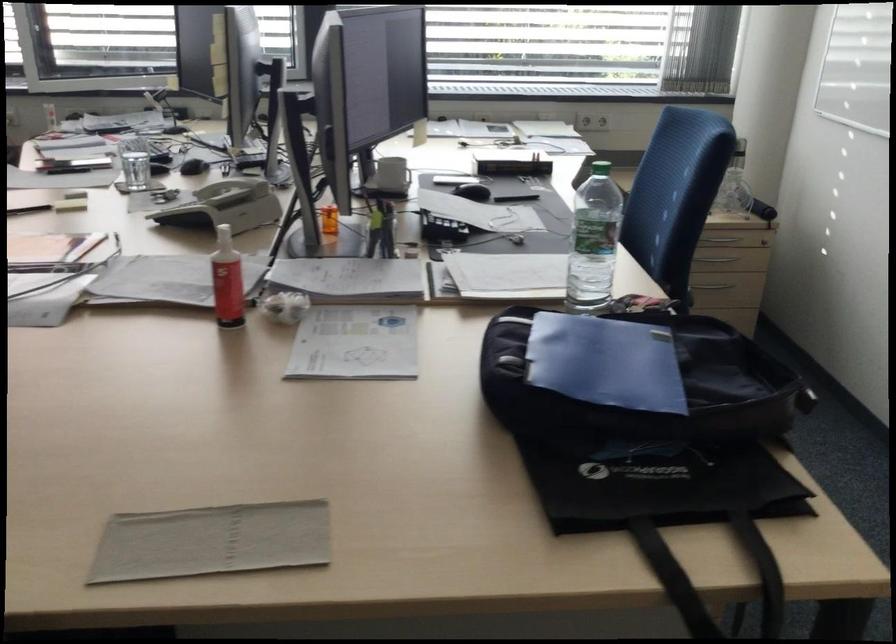
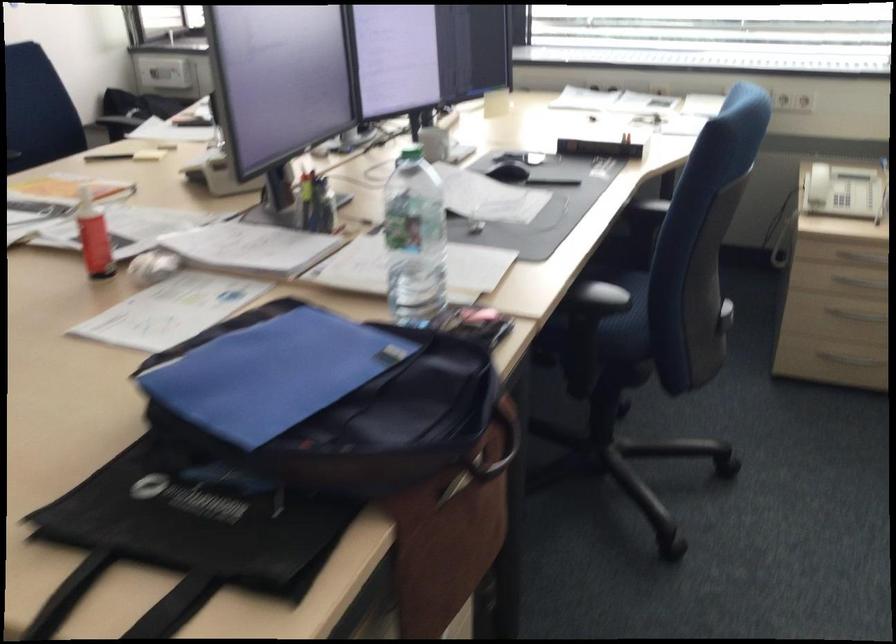
Where in the second image is the point corresponding to pixel 703 552 from the first image?

(124, 601)